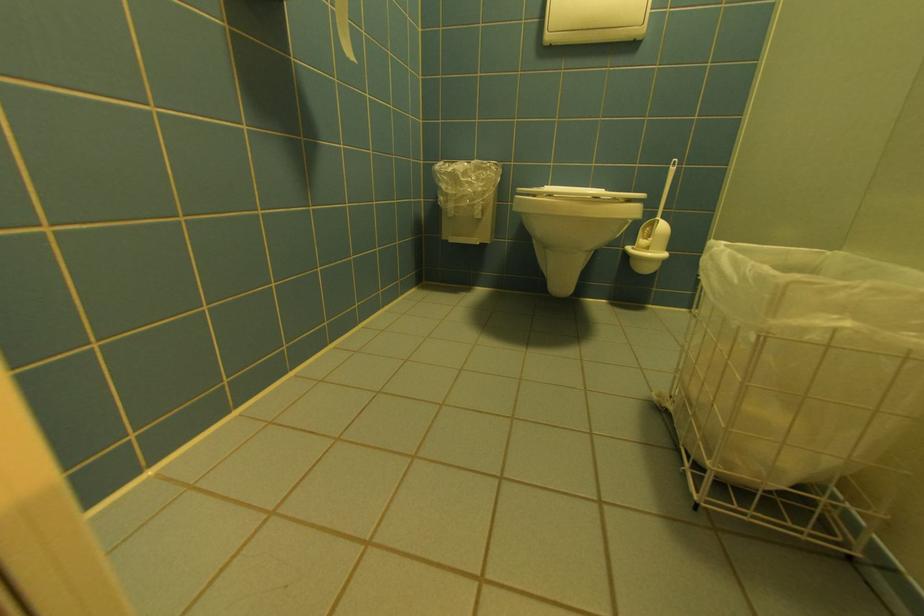
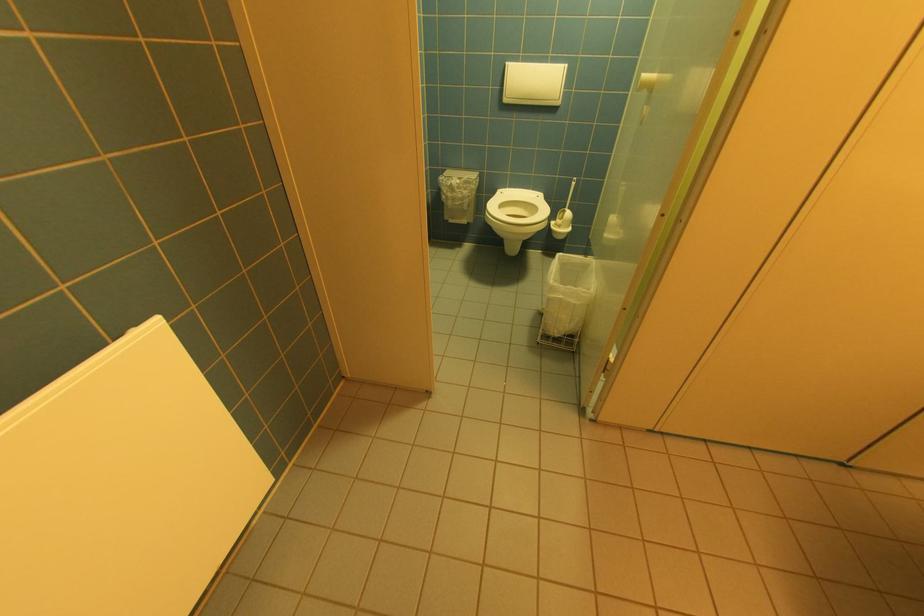
Locate, in the second image, the point that corresponds to (x=554, y=38) in the first image.

(512, 100)